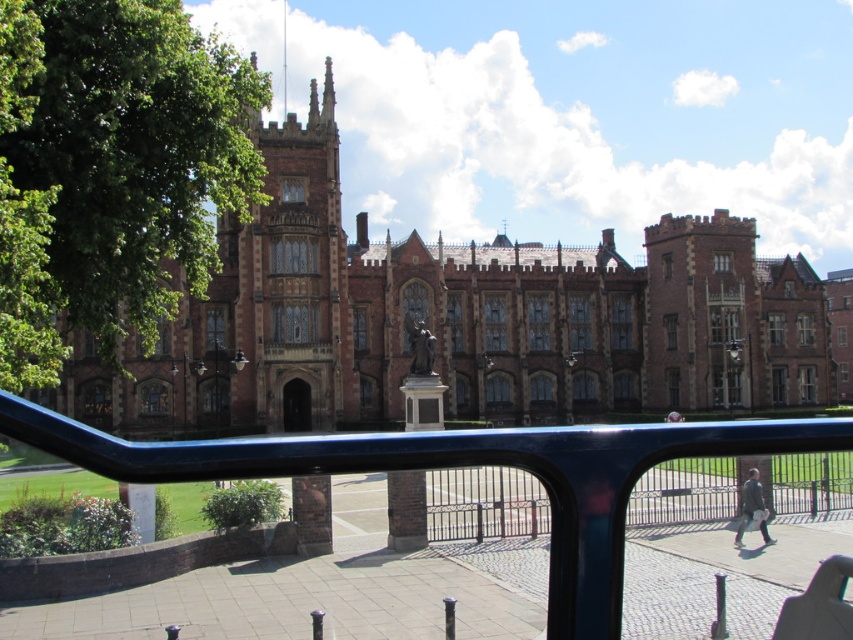
Question: Is brown stone palace at center positioned behind glossy metal rail at center?

Choices:
 (A) yes
 (B) no

Answer: (A)

Question: Which of the following is the farthest from the observer?

Choices:
 (A) (554, 429)
 (B) (361, 388)

Answer: (B)

Question: Which of the following is the farthest from the observer?

Choices:
 (A) (514, 314)
 (B) (601, 522)

Answer: (A)

Question: Can you confirm if brown stone palace at center is wider than glossy metal rail at center?

Choices:
 (A) no
 (B) yes

Answer: (B)

Question: Is brown stone palace at center in front of glossy metal rail at center?

Choices:
 (A) no
 (B) yes

Answer: (A)